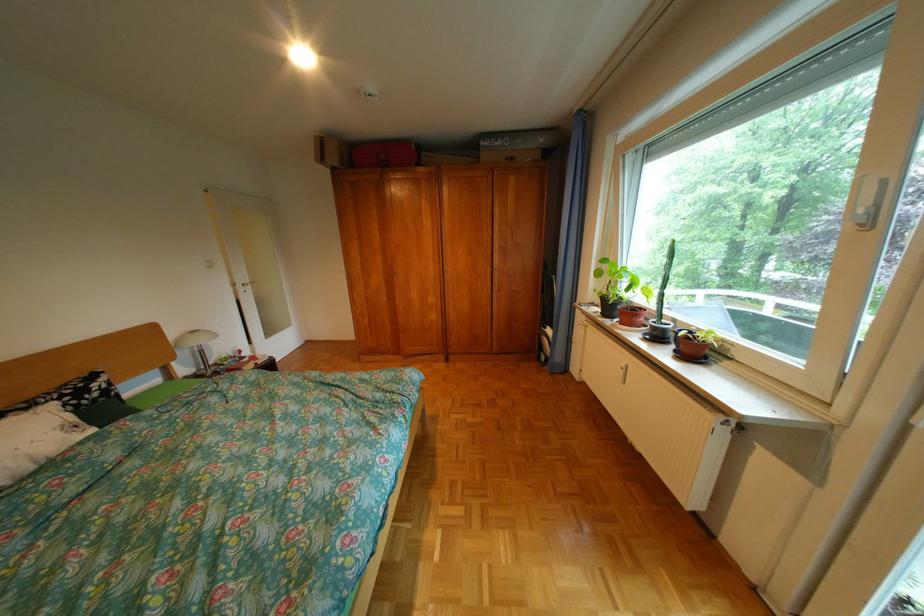
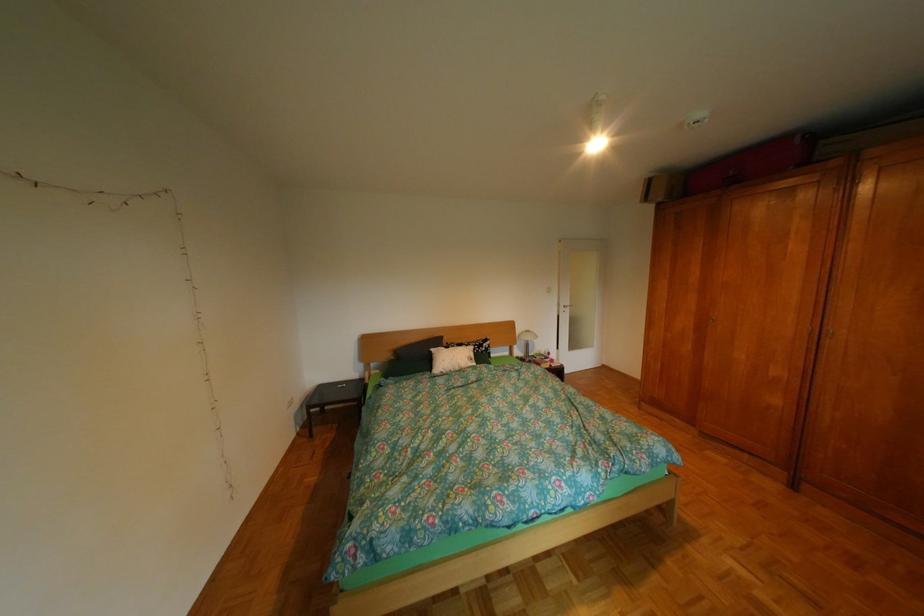
In the second image, find the point that corresponds to [429,148] in the first image.

(812, 142)